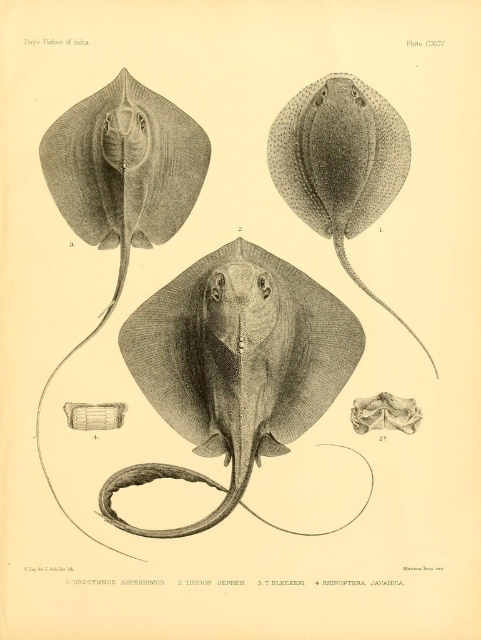
Does gray textured stingray at center appear over smooth gray stingray at center?

Incorrect, gray textured stingray at center is not positioned above smooth gray stingray at center.

Is point (262, 396) behind point (379, 180)?

No, it is in front of (379, 180).

The width and height of the screenshot is (481, 640). Identify the location of gray textured stingray at center. (240, 352).

Does gray textured stingray at upper left have a lesser width compared to smooth gray stingray at center?

No, gray textured stingray at upper left is not thinner than smooth gray stingray at center.

Is gray textured stingray at upper left to the left of smooth gray stingray at center from the viewer's perspective?

Yes, gray textured stingray at upper left is to the left of smooth gray stingray at center.

Which is behind, point (125, 104) or point (276, 179)?

Positioned behind is point (276, 179).

I want to click on gray textured stingray at upper left, so click(125, 164).

Does gray textured stingray at center appear on the right side of gray textured stingray at upper left?

Yes, gray textured stingray at center is to the right of gray textured stingray at upper left.

Is gray textured stingray at center thinner than gray textured stingray at upper left?

No, gray textured stingray at center is not thinner than gray textured stingray at upper left.

Does point (182, 413) come farther from viewer compared to point (141, 228)?

No.

This screenshot has width=481, height=640. In order to click on gray textured stingray at center in this screenshot , I will do pos(240,352).